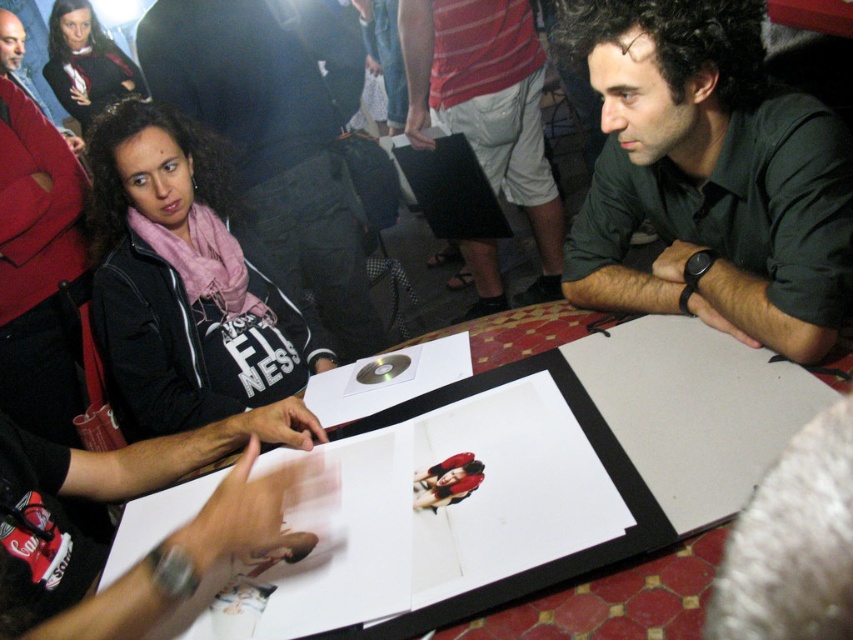
You are attending a signing event and notice two items on the table. The white cotton shorts at center and the matte black scarf at upper left. Which item is positioned lower on the table?

The white cotton shorts at center is below matte black scarf at upper left, so the white cotton shorts at center is positioned lower on the table.

Based on the photo, you are standing in the signing event scene. You need to place a small sticker exactly at the center of the white cotton shorts at center. According to the coordinates provided, where should you place the sticker?

The sticker should be placed at the coordinates point (486, 106), which is the 2D location of the white cotton shorts at center.

You are attending a signing event and want to place a matte black jacket at upper left on the table. The table is located at coordinates point (276, 138). Can you confirm if there is enough space for the matte black jacket at upper left at that location?

At point (276, 138) lies the matte black jacket at upper left, so placing another matte black jacket at upper left there would not be possible as the space is already occupied.